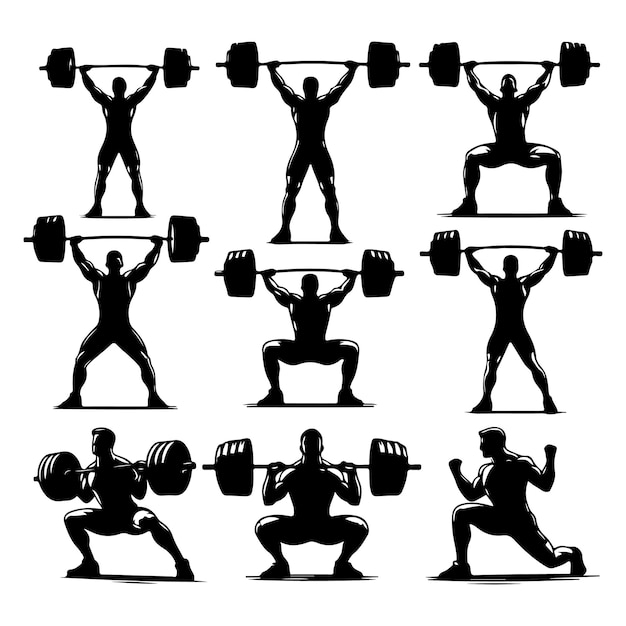
Where is `chest`? The image size is (626, 626). chest is located at coordinates (106, 481), (305, 490), (495, 480), (508, 313), (307, 295), (121, 279), (120, 118), (300, 104), (511, 105).